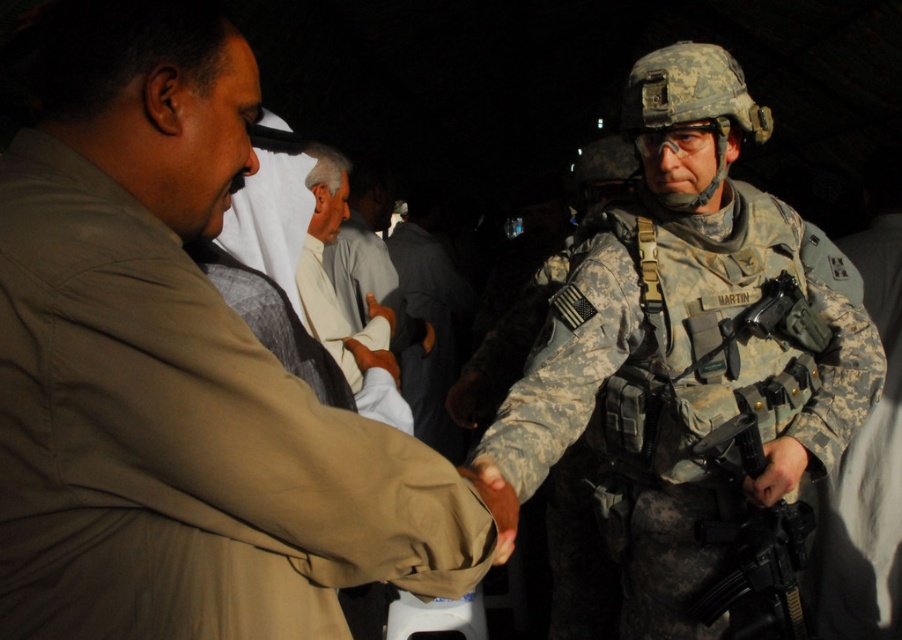
You are a security officer who needs to inspect the black matte rifle at right and the white cotton shirt at center. Based on their positions, which object is closer to the floor?

The black matte rifle at right is located below the white cotton shirt at center, so it is closer to the floor.

You are a security officer tasked with identifying objects in the scene. You notice the tan fabric shirt at center and the matte black gun at lower right. Which object occupies a larger area in the image?

The tan fabric shirt at center is bigger than the matte black gun at lower right, so the tan fabric shirt at center occupies a larger area in the image.

You are an observer in the nighttime scene. You see the tan fabric shirt at center and the matte black gun at lower right. Which object is positioned higher in the image?

The tan fabric shirt at center is located above the matte black gun at lower right, so it is positioned higher in the image.